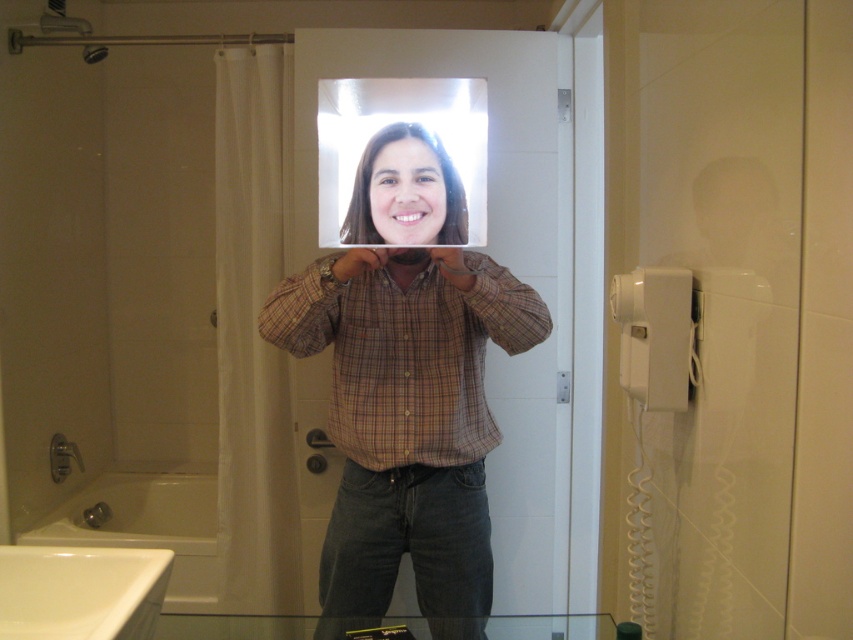
Question: Does matte plastic tablet at center appear under clear plastic mirror at center?

Choices:
 (A) no
 (B) yes

Answer: (B)

Question: Is matte plastic tablet at center wider than clear plastic mirror at center?

Choices:
 (A) no
 (B) yes

Answer: (B)

Question: Which point is farther from the camera taking this photo?

Choices:
 (A) (479, 225)
 (B) (419, 557)

Answer: (B)

Question: Can you confirm if matte plastic tablet at center is thinner than clear plastic mirror at center?

Choices:
 (A) yes
 (B) no

Answer: (B)